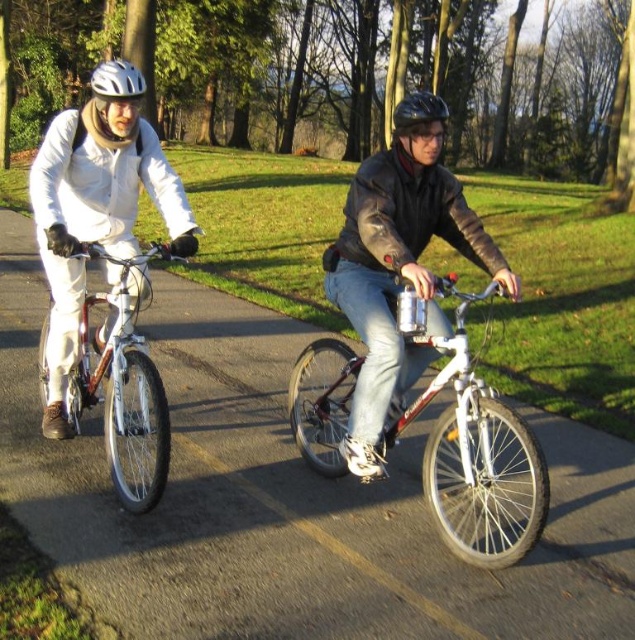
Question: Which point appears farthest from the camera in this image?

Choices:
 (A) (533, 493)
 (B) (271, 394)

Answer: (B)

Question: Which of these objects is positioned closest to the matte black jacket at center?

Choices:
 (A) metallic silver bicycle at center
 (B) shiny metallic bicycle at left
 (C) black matte bicycle helmet at center
 (D) white matte helmet at upper left

Answer: (C)

Question: Is matte white jacket at left below black matte bicycle helmet at center?

Choices:
 (A) yes
 (B) no

Answer: (A)

Question: Among these objects, which one is farthest from the camera?

Choices:
 (A) metallic silver bicycle at center
 (B) white matte bicycle helmet at upper left
 (C) shiny metallic bicycle at left
 (D) black matte bicycle helmet at center

Answer: (B)

Question: Is matte black jacket at center to the right of white matte bicycle helmet at upper left from the viewer's perspective?

Choices:
 (A) yes
 (B) no

Answer: (A)

Question: Is matte black jacket at center in front of black matte bicycle helmet at center?

Choices:
 (A) yes
 (B) no

Answer: (A)